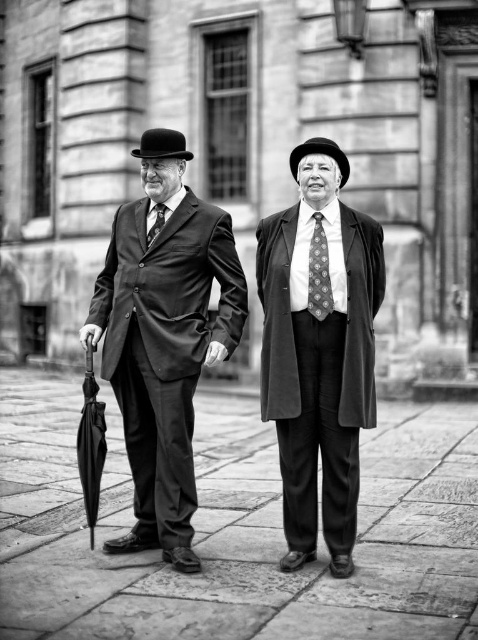
Is point (289, 541) closer to camera compared to point (341, 170)?

Yes, point (289, 541) is in front of point (341, 170).

In the scene shown: Does smooth wool coat at center have a lesser width compared to matte black hat at center?

Incorrect, smooth wool coat at center's width is not less than matte black hat at center's.

This screenshot has width=478, height=640. Describe the element at coordinates (318, 349) in the screenshot. I see `smooth wool coat at center` at that location.

Image resolution: width=478 pixels, height=640 pixels. In order to click on smooth wool coat at center in this screenshot , I will do `click(318, 349)`.

This screenshot has height=640, width=478. Describe the element at coordinates (90, 442) in the screenshot. I see `black matte umbrella at left` at that location.

Does black matte umbrella at left appear on the right side of black felt bowler hat at center?

No, black matte umbrella at left is not to the right of black felt bowler hat at center.

Where is `black matte umbrella at left`? This screenshot has height=640, width=478. black matte umbrella at left is located at coordinates (90, 442).

The width and height of the screenshot is (478, 640). What are the coordinates of `black matte umbrella at left` in the screenshot? It's located at (90, 442).

Does smooth black suit at center have a lesser height compared to black matte umbrella at left?

Incorrect, smooth black suit at center's height does not fall short of black matte umbrella at left's.

Which is behind, point (141, 173) or point (96, 417)?

The point (141, 173) is behind.

Which is in front, point (202, 228) or point (87, 476)?

Point (87, 476) is more forward.

The image size is (478, 640). What are the coordinates of `smooth black suit at center` in the screenshot? It's located at point(163,346).